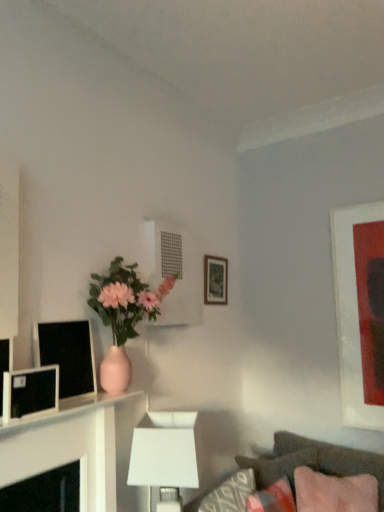
Question: Is matte pink vase at center shorter than matte black monitor at left, which ranks as the 1th computer monitor in back-to-front order?

Choices:
 (A) yes
 (B) no

Answer: (B)

Question: Does matte pink vase at center lie behind matte black monitor at left, which ranks as the 1th computer monitor in back-to-front order?

Choices:
 (A) no
 (B) yes

Answer: (B)

Question: Is matte pink vase at center oriented away from matte black monitor at left, which ranks as the 1th computer monitor in back-to-front order?

Choices:
 (A) yes
 (B) no

Answer: (B)

Question: Does matte pink vase at center appear on the right side of matte black monitor at left, which ranks as the 1th computer monitor in back-to-front order?

Choices:
 (A) yes
 (B) no

Answer: (A)

Question: Can you confirm if matte pink vase at center is smaller than matte black monitor at left, the second computer monitor in the front-to-back sequence?

Choices:
 (A) yes
 (B) no

Answer: (B)

Question: Is matte pink vase at center outside of matte black monitor at left, the second computer monitor in the front-to-back sequence?

Choices:
 (A) no
 (B) yes

Answer: (B)

Question: Does white matte table lamp at lower center appear on the left side of matte white picture frame at right, which ranks as the 1th picture frame in front-to-back order?

Choices:
 (A) no
 (B) yes

Answer: (B)

Question: Can you confirm if white matte table lamp at lower center is wider than matte white picture frame at right, which ranks as the 1th picture frame in front-to-back order?

Choices:
 (A) yes
 (B) no

Answer: (A)

Question: Is white matte table lamp at lower center positioned beyond the bounds of matte white picture frame at right, arranged as the 2th picture frame when viewed from the back?

Choices:
 (A) yes
 (B) no

Answer: (A)

Question: Is white matte table lamp at lower center further to the viewer compared to matte white picture frame at right, the first picture frame viewed from the right?

Choices:
 (A) no
 (B) yes

Answer: (A)

Question: From the image's perspective, is white matte table lamp at lower center on top of matte white picture frame at right, arranged as the 2th picture frame when viewed from the back?

Choices:
 (A) yes
 (B) no

Answer: (B)

Question: Is white matte table lamp at lower center shorter than matte white picture frame at right, arranged as the 2th picture frame when viewed from the back?

Choices:
 (A) yes
 (B) no

Answer: (A)

Question: Could you tell me if pink fabric pillow at lower right, acting as the first pillow starting from the back, is facing velvet brown couch at lower right?

Choices:
 (A) yes
 (B) no

Answer: (A)